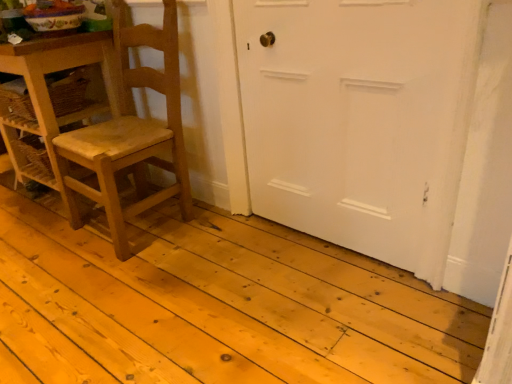
Identify the location of vacant region below wooden chair at left (from a real-world perspective). (141, 223).